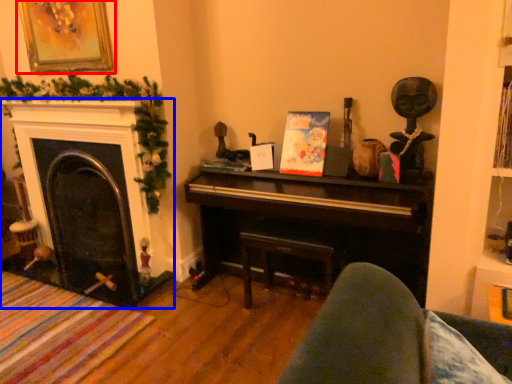
Question: Which object is closer to the camera taking this photo, picture frame (highlighted by a red box) or fireplace (highlighted by a blue box)?

Choices:
 (A) picture frame
 (B) fireplace

Answer: (A)